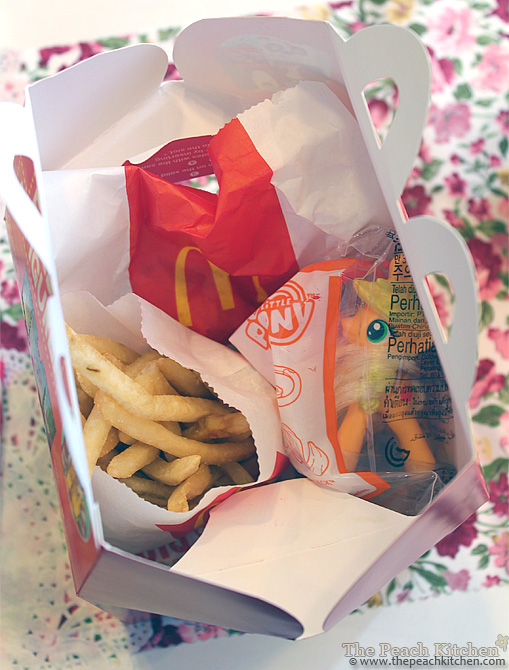
Find the location of a particular element. my little pony toy is located at coordinates (356, 332).